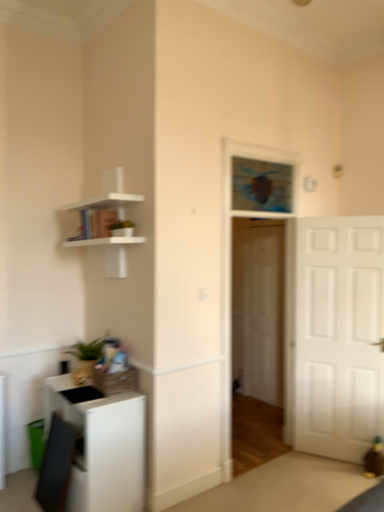
Question: From a real-world perspective, is white wooden door at center, which is the first door from back to front, positioned above or below white matte cabinet at lower left?

Choices:
 (A) above
 (B) below

Answer: (A)

Question: Is point (249, 238) positioned closer to the camera than point (72, 495)?

Choices:
 (A) farther
 (B) closer

Answer: (A)

Question: Estimate the real-world distances between objects in this image. Which object is closer to the blue glass window at center?

Choices:
 (A) white matte shelf at upper left
 (B) white matte door at right, which is the second door in back-to-front order
 (C) white matte cabinet at lower left
 (D) white wooden door at center, which is the 2th door from front to back

Answer: (B)

Question: Which object is positioned farthest from the white matte door at right, which is the second door in back-to-front order?

Choices:
 (A) white matte cabinet at lower left
 (B) white matte shelf at upper left
 (C) blue glass window at center
 (D) white wooden door at center, which is the 2th door from front to back

Answer: (B)